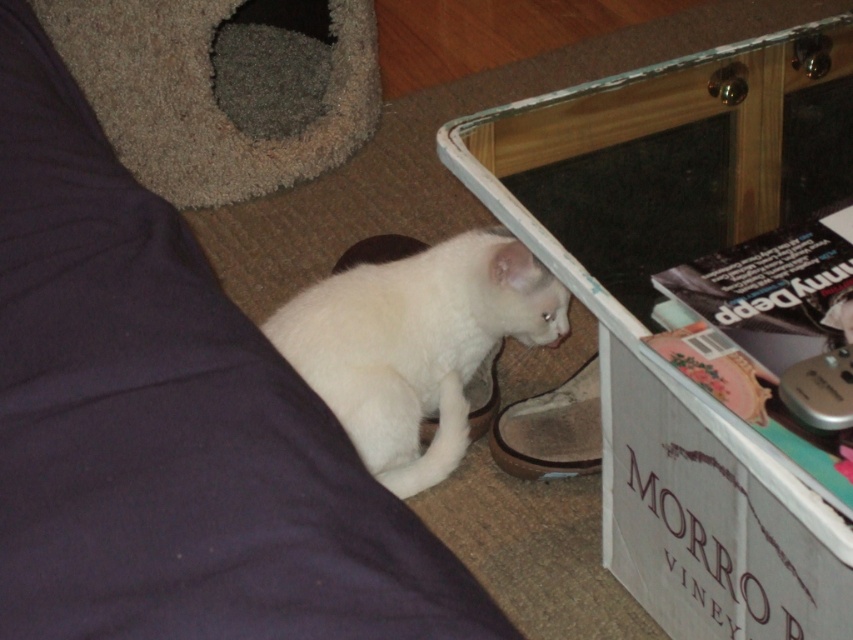
You are a guest in this room and want to place a small plant on the transparent glass table at lower right without blocking the view of the white fluffy cat at lower center. Is the table large enough to accommodate the plant?

The transparent glass table at lower right has a larger size compared to the white fluffy cat at lower center, so it should be large enough to place the small plant without blocking the view of the cat.

You are standing in the room and want to place a 24 inch long toy on the floor between yourself and the transparent glass table at lower right. Can you fit the toy completely between yourself and the table without it overlapping either?

The distance between you and the transparent glass table at lower right is 24.67 inches. Since the toy is 24 inches long, it can fit completely within that space without overlapping either end.

You are a delivery robot that is 18 inches wide. You are in the room and need to move from the entrance to the transparent glass table at lower right. Is there enough space for you to pass through the area near the kitten and the cat tree?

The transparent glass table at lower right is 24.67 inches away from the camera. Since the robot is 18 inches wide, there is sufficient space for it to pass through the area near the kitten and the cat tree as the distance is greater than the robot width.